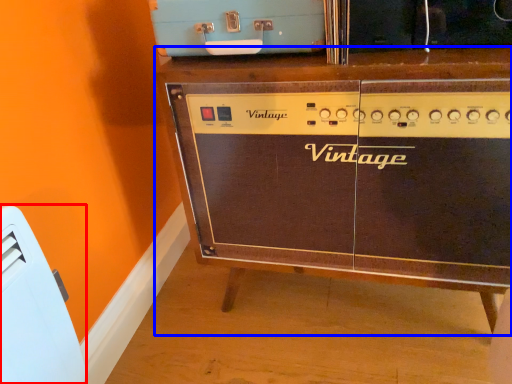
Question: Which point is further to the camera, appliance (highlighted by a red box) or furniture (highlighted by a blue box)?

Choices:
 (A) appliance
 (B) furniture

Answer: (B)